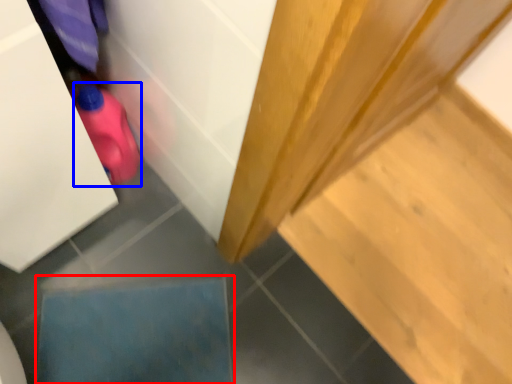
Question: Among these objects, which one is farthest to the camera, square (highlighted by a red box) or stuff (highlighted by a blue box)?

Choices:
 (A) square
 (B) stuff

Answer: (A)